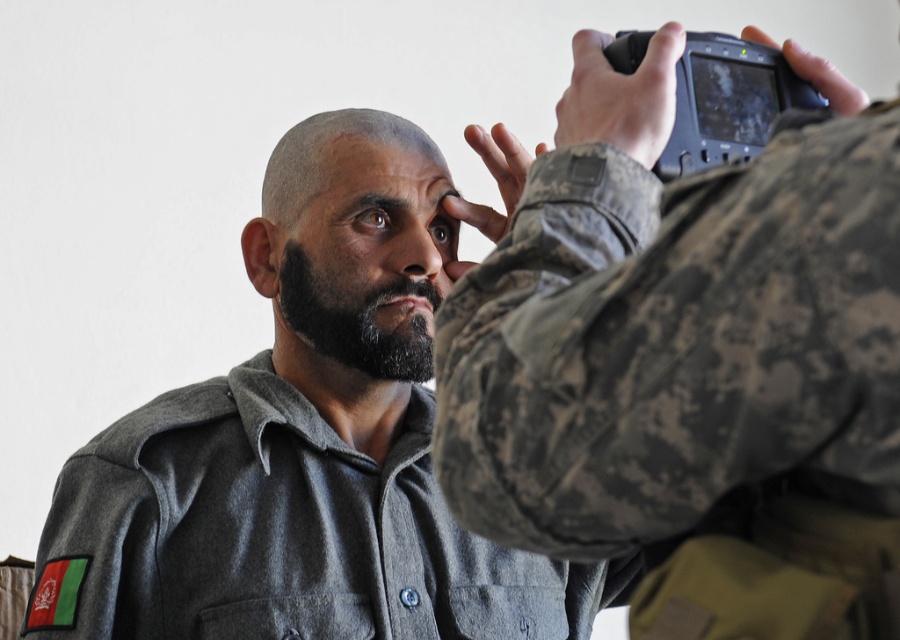
Can you confirm if camouflage fabric at upper right is smaller than gray matte shirt at center?

Yes.

Is camouflage fabric at upper right to the right of gray matte shirt at center from the viewer's perspective?

Indeed, camouflage fabric at upper right is positioned on the right side of gray matte shirt at center.

Is point (443, 362) in front of point (387, 312)?

Yes, point (443, 362) is in front of point (387, 312).

Find the location of `camouflage fabric at upper right`. camouflage fabric at upper right is located at coordinates (678, 346).